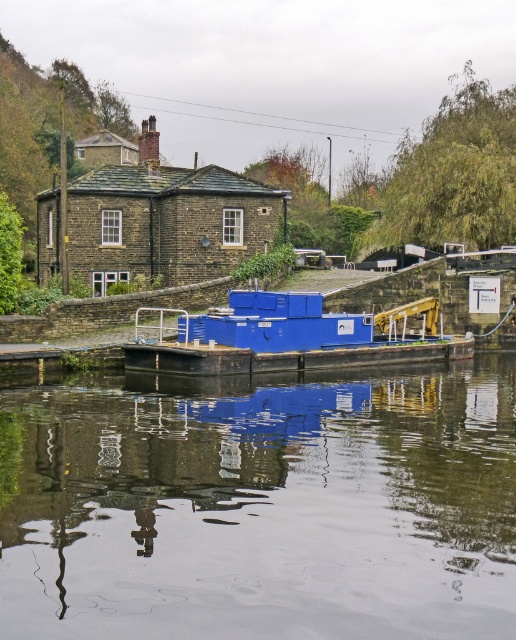
Which is more to the left, smooth reflective water at center or blue matte container at center?

blue matte container at center

Can you confirm if smooth reflective water at center is taller than blue matte container at center?

No.

Is point (115, 604) behind point (174, 384)?

No.

Where is `smooth reflective water at center`? This screenshot has width=516, height=640. smooth reflective water at center is located at coordinates (262, 506).